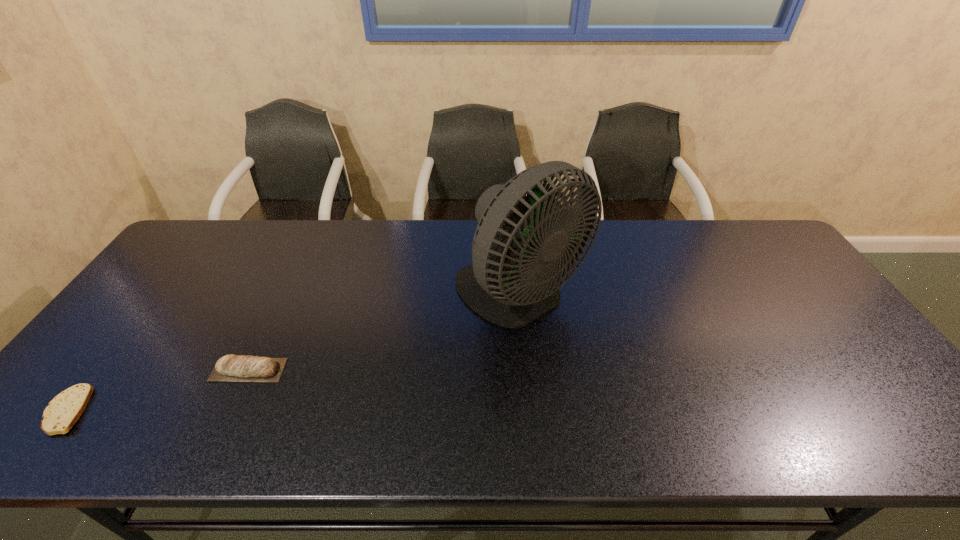
The width and height of the screenshot is (960, 540). I want to click on object present at the near edge, so (65, 409).

In order to click on object present at the left edge in this screenshot , I will do `click(65, 409)`.

Identify the location of object that is at the near left corner. [65, 409].

The width and height of the screenshot is (960, 540). I want to click on vacant position at the far edge of the desktop, so click(x=377, y=244).

I want to click on free space at the near edge of the desktop, so click(x=264, y=424).

Where is `blank space at the left edge of the desktop`? This screenshot has width=960, height=540. blank space at the left edge of the desktop is located at coordinates point(107,341).

The image size is (960, 540). In the image, there is a desktop. What are the coordinates of `free region at the right edge` in the screenshot? It's located at (876, 376).

You are a GUI agent. You are given a task and a screenshot of the screen. Output one action in this format:
    pyautogui.click(x=<x>, y=<y>)
    Task: Click on the blank space at the far left corner of the desktop
    Image resolution: width=960 pixels, height=540 pixels.
    Given the screenshot: What is the action you would take?
    pyautogui.click(x=229, y=247)

I want to click on vacant space at the far right corner of the desktop, so click(x=733, y=234).

I want to click on unoccupied position between the shortest object and the farthest object, so click(x=294, y=353).